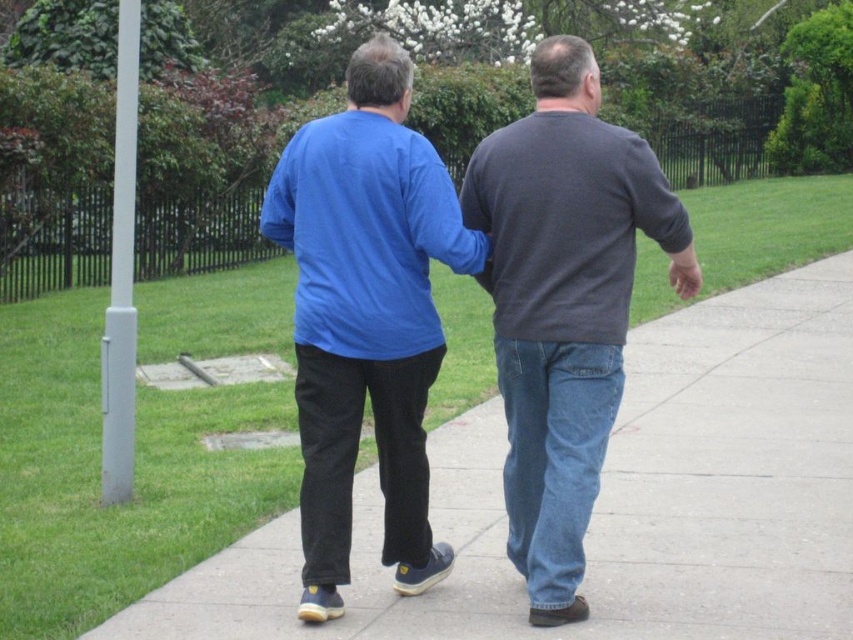
Does blue matte shirt at center appear on the right side of dark gray sweater at center?

No, blue matte shirt at center is not to the right of dark gray sweater at center.

Is blue matte shirt at center wider than dark gray sweater at center?

Incorrect, blue matte shirt at center's width does not surpass dark gray sweater at center's.

You are a GUI agent. You are given a task and a screenshot of the screen. Output one action in this format:
    pyautogui.click(x=<x>, y=<y>)
    Task: Click on the blue matte shirt at center
    
    Given the screenshot: What is the action you would take?
    pyautogui.click(x=366, y=316)

You are a GUI agent. You are given a task and a screenshot of the screen. Output one action in this format:
    pyautogui.click(x=<x>, y=<y>)
    Task: Click on the blue matte shirt at center
    Image resolution: width=853 pixels, height=640 pixels.
    Given the screenshot: What is the action you would take?
    (366, 316)

Which is in front, point (461, 456) or point (531, 346)?

Point (531, 346)

Between concrete sidewalk at center and dark gray sweater at center, which one is positioned higher?

dark gray sweater at center

Between point (599, 576) and point (543, 65), which one is positioned behind?

Positioned behind is point (599, 576).

Image resolution: width=853 pixels, height=640 pixels. I want to click on concrete sidewalk at center, so click(x=614, y=500).

Describe the element at coordinates (614, 500) in the screenshot. The image size is (853, 640). I see `concrete sidewalk at center` at that location.

Does concrete sidewalk at center lie in front of blue matte shirt at center?

No, it is behind blue matte shirt at center.

Who is more forward, (757, 364) or (379, 54)?

Point (379, 54) is more forward.

Find the location of a particular element. concrete sidewalk at center is located at coordinates (614, 500).